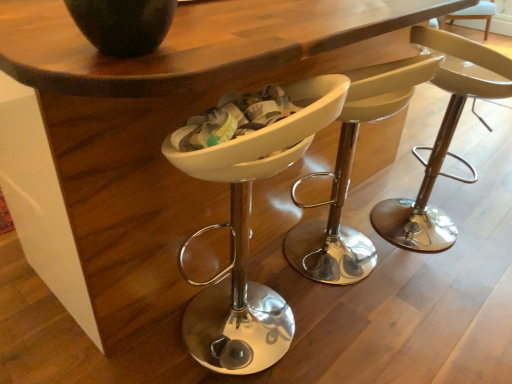
You are a GUI agent. You are given a task and a screenshot of the screen. Output one action in this format:
    pyautogui.click(x=<x>, y=<y>)
    Task: Click on the free spot below matte black vase at upper left (from a real-world perspective)
    This screenshot has height=384, width=512.
    Given the screenshot: What is the action you would take?
    pyautogui.click(x=120, y=49)